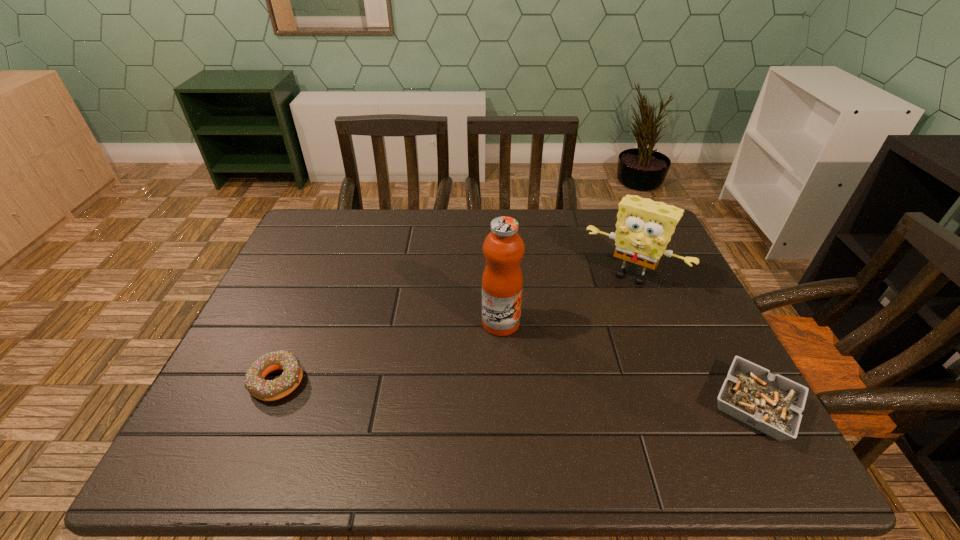
This screenshot has width=960, height=540. I want to click on vacant space that satisfies the following two spatial constraints: 1. on the front side of the ashtray; 2. on the left side of the leftmost object, so click(267, 406).

Where is `vacant space that satisfies the following two spatial constraints: 1. on the front side of the ashtray; 2. on the left side of the second tallest object`? vacant space that satisfies the following two spatial constraints: 1. on the front side of the ashtray; 2. on the left side of the second tallest object is located at coordinates (683, 406).